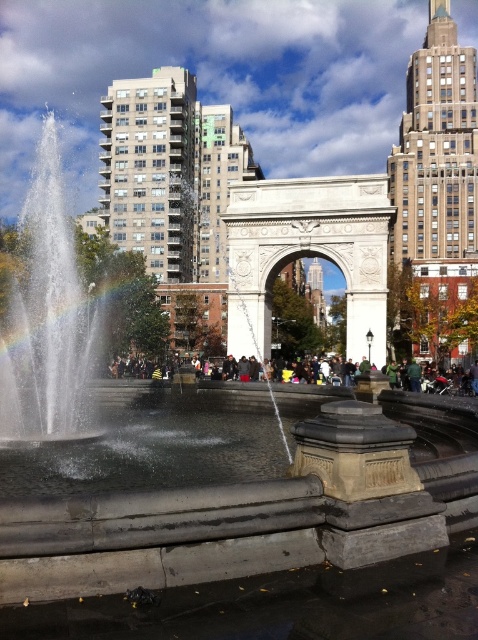
Is rainbow at center wider than dark green fabric at center?

No, rainbow at center is not wider than dark green fabric at center.

Image resolution: width=478 pixels, height=640 pixels. I want to click on rainbow at center, so click(119, 304).

At what (x,y) coordinates should I click in order to perform the action: click on rainbow at center. Please return your answer as a coordinate pair (x, y). The height and width of the screenshot is (640, 478). Looking at the image, I should click on (119, 304).